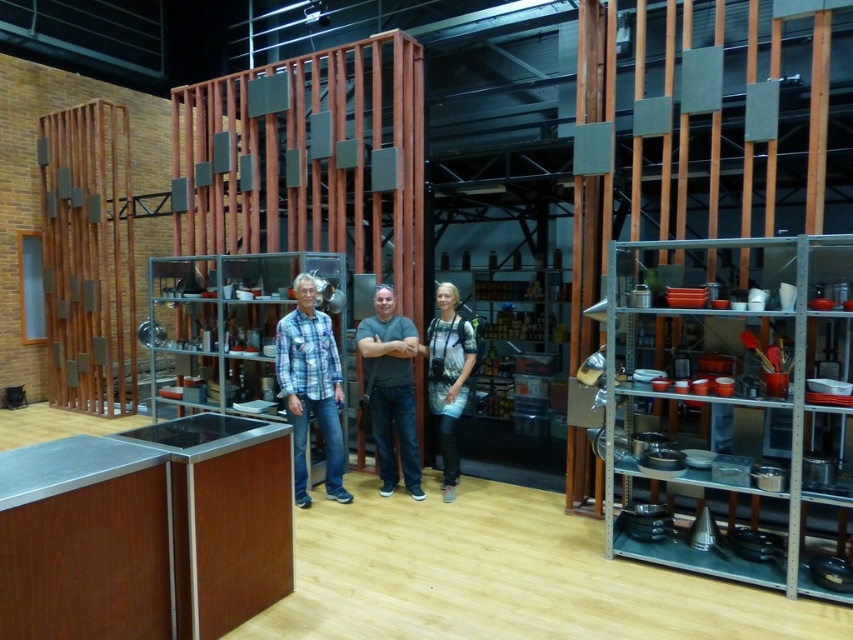
You are trying to determine which clothing item is taller between the blue plaid shirt at center and the denim jacket at center. Based on the scene, which one is taller?

The blue plaid shirt at center is taller than the denim jacket at center according to the description.

You are trying to fit through a narrow doorway that is 1.2 meters wide. You see the blue plaid shirt at center and the gray matte shirt at center in the scene. Which person should move aside first to ensure you can pass through?

The blue plaid shirt at center might be wider than gray matte shirt at center, so the person wearing the blue plaid shirt at center should move aside first to ensure there is enough space for you to pass through the 1.2 meter wide doorway.

You are taking a photo of the blue plaid shirt at center and the gray matte shirt at center. Which one should you focus on first to ensure both are in focus?

The blue plaid shirt at center is closer to the viewer than the gray matte shirt at center, so you should focus on the blue plaid shirt at center first to ensure both are in focus.